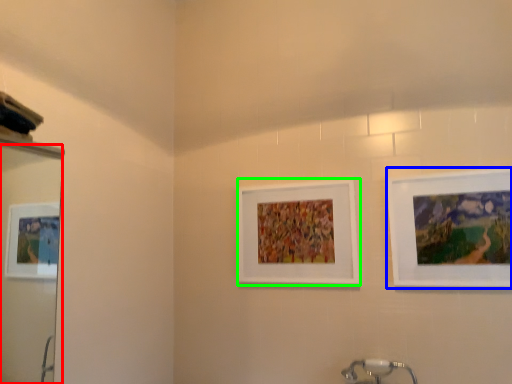
Question: Based on their relative distances, which object is nearer to mirror (highlighted by a red box)? Choose from picture frame (highlighted by a blue box) and picture frame (highlighted by a green box).

Choices:
 (A) picture frame
 (B) picture frame

Answer: (B)